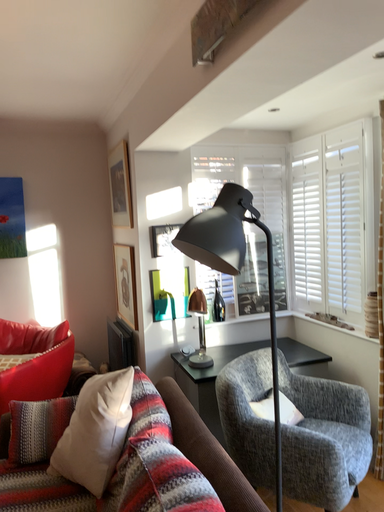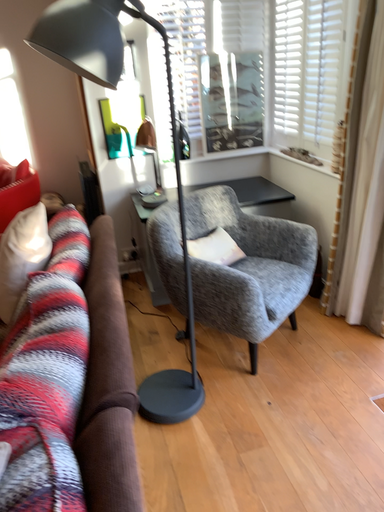
Question: How did the camera likely rotate when shooting the video?

Choices:
 (A) rotated upward
 (B) rotated downward

Answer: (B)